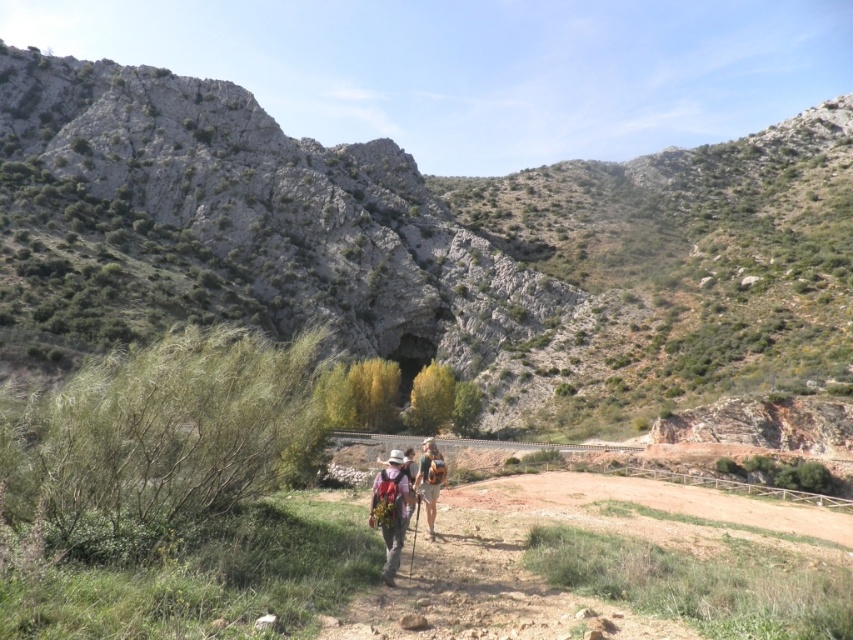
Between matte pink backpack at center and camouflage fabric backpack at center, which one has less height?

matte pink backpack at center

Which is behind, point (392, 458) or point (425, 499)?

Positioned behind is point (425, 499).

Is point (379, 486) positioned behind point (440, 467)?

No, (379, 486) is in front of (440, 467).

What are the coordinates of `matte pink backpack at center` in the screenshot? It's located at (392, 509).

Between rocky at center and matte pink backpack at center, which one has less height?

With less height is matte pink backpack at center.

Does rocky at center appear under matte pink backpack at center?

No.

Does point (561, 220) come behind point (392, 518)?

Yes, it is.

Where is `rocky at center`? rocky at center is located at coordinates (428, 246).

Who is more forward, (437, 241) or (433, 500)?

Point (433, 500) is in front.

Is rocky at center shorter than camouflage fabric backpack at center?

In fact, rocky at center may be taller than camouflage fabric backpack at center.

The width and height of the screenshot is (853, 640). Describe the element at coordinates (428, 246) in the screenshot. I see `rocky at center` at that location.

Find the location of a particular element. rocky at center is located at coordinates (428, 246).